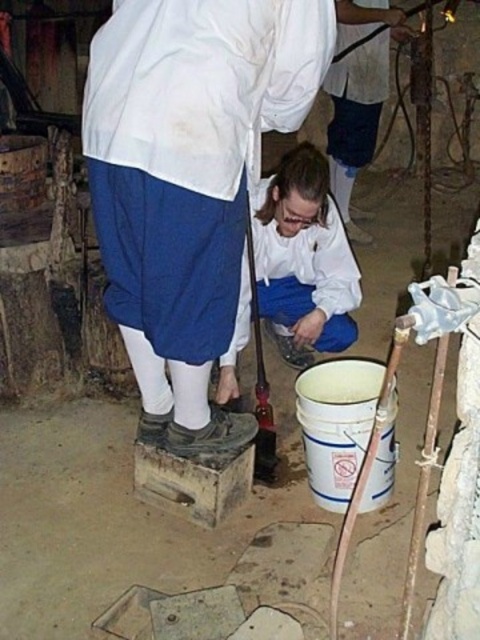
Does point (202, 164) lie in front of point (349, 56)?

That is True.

You are a GUI agent. You are given a task and a screenshot of the screen. Output one action in this format:
    pyautogui.click(x=<x>, y=<y>)
    Task: Click on the blue cotton skirt at center
    Image resolution: width=480 pixels, height=640 pixels.
    Given the screenshot: What is the action you would take?
    pyautogui.click(x=189, y=179)